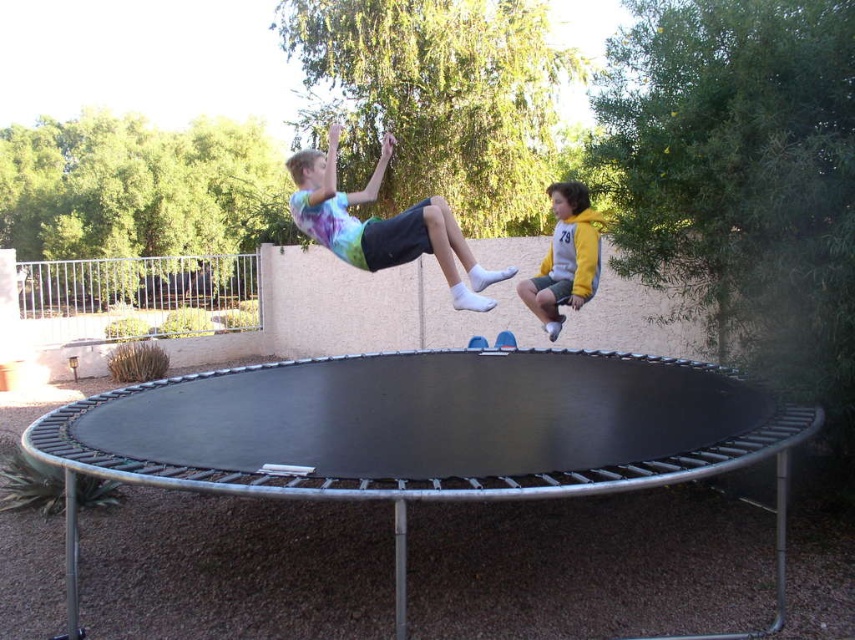
Does tie-dye fabric shirt at upper center appear on the left side of yellow fleece jacket at upper right?

Yes, tie-dye fabric shirt at upper center is to the left of yellow fleece jacket at upper right.

Is tie-dye fabric shirt at upper center thinner than yellow fleece jacket at upper right?

Incorrect, tie-dye fabric shirt at upper center's width is not less than yellow fleece jacket at upper right's.

Identify the location of tie-dye fabric shirt at upper center. This screenshot has width=855, height=640. (382, 225).

The height and width of the screenshot is (640, 855). What are the coordinates of `tie-dye fabric shirt at upper center` in the screenshot? It's located at (382, 225).